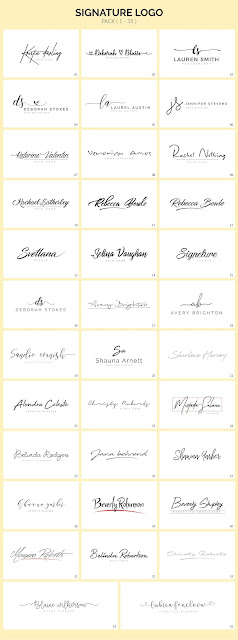
In order to click on two boxes in row in this screenshot , I will do `click(99, 608)`, `click(137, 604)`.